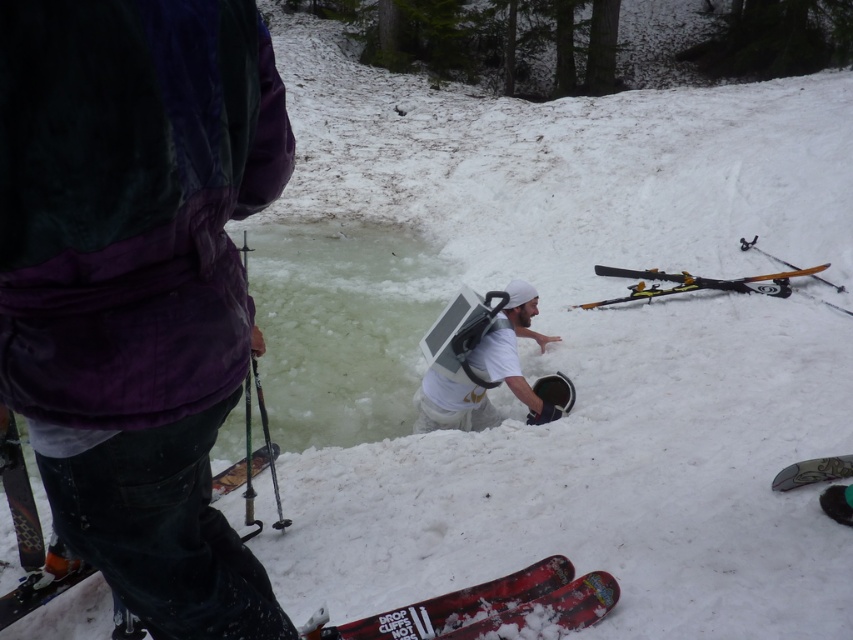
Measure the distance between purple fleece jacket at upper left and camera.

They are 38.92 inches apart.

Can you confirm if purple fleece jacket at upper left is positioned to the left of white matte laptop at center?

Indeed, purple fleece jacket at upper left is positioned on the left side of white matte laptop at center.

The image size is (853, 640). Describe the element at coordinates (137, 284) in the screenshot. I see `purple fleece jacket at upper left` at that location.

Where is `purple fleece jacket at upper left`? purple fleece jacket at upper left is located at coordinates (137, 284).

Can you confirm if red matte snowboard at lower center is thinner than yellow metallic skis at upper right?

Yes.

Is point (519, 598) more distant than point (721, 289)?

No.

Describe the element at coordinates (451, 608) in the screenshot. I see `red matte snowboard at lower center` at that location.

The image size is (853, 640). Find the location of `red matte snowboard at lower center`. red matte snowboard at lower center is located at coordinates tap(451, 608).

Where is `purple fleece jacket at upper left`? This screenshot has height=640, width=853. purple fleece jacket at upper left is located at coordinates (137, 284).

Can you confirm if purple fleece jacket at upper left is smaller than red matte snowboard at lower center?

Incorrect, purple fleece jacket at upper left is not smaller in size than red matte snowboard at lower center.

Between point (103, 109) and point (526, 588), which one is positioned behind?

Positioned behind is point (526, 588).

Where is `purple fleece jacket at upper left`? purple fleece jacket at upper left is located at coordinates (137, 284).